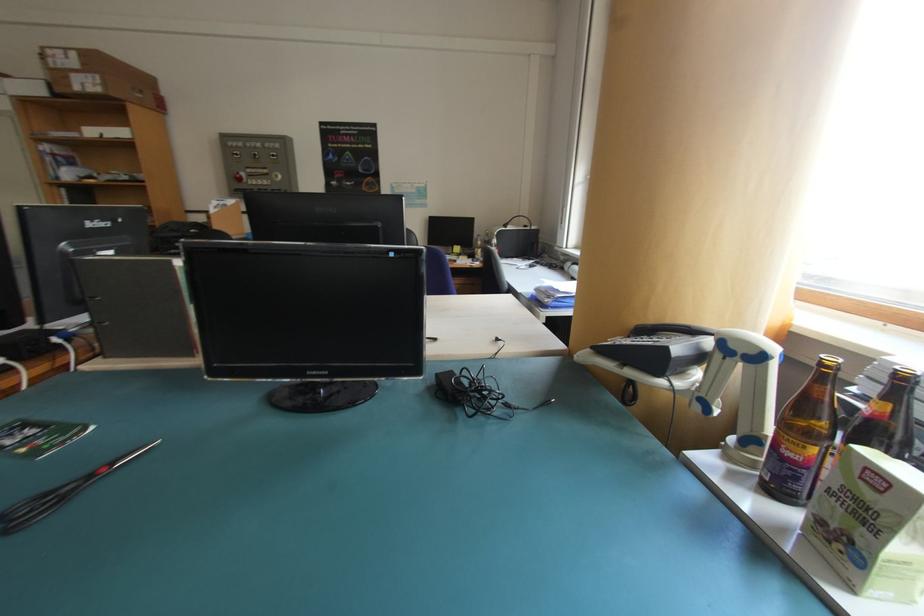
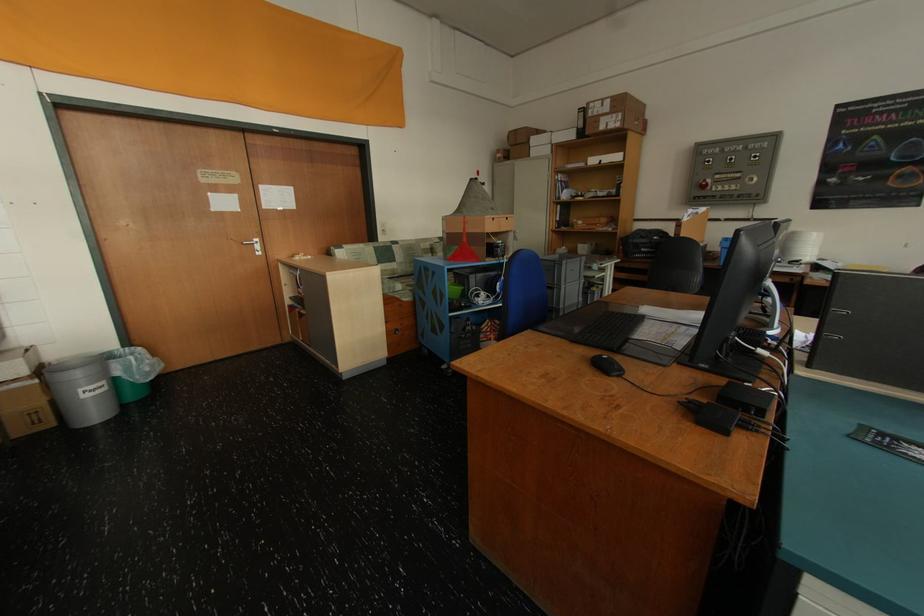
Find the pixel in the second image that matches point (245, 176) in the first image.

(709, 183)